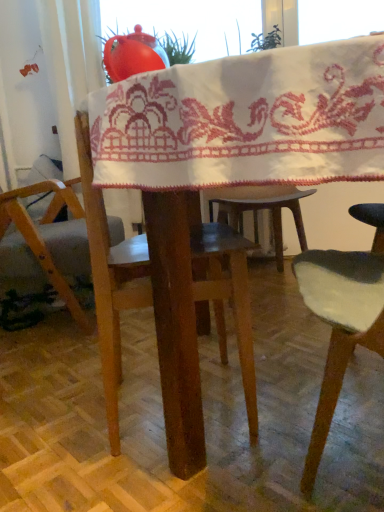
Locate an element on the screen. The width and height of the screenshot is (384, 512). wooden chair at left is located at coordinates (45, 244).

The height and width of the screenshot is (512, 384). In order to click on white embroidered cloth at center in this screenshot , I will do coord(245,120).

Which of these two, white embroidered cloth at center or wooden table at center, stands taller?

Standing taller between the two is wooden table at center.

How different are the orientations of white embroidered cloth at center and wooden table at center in degrees?

There is a 3.95e-05-degree angle between the facing directions of white embroidered cloth at center and wooden table at center.

This screenshot has width=384, height=512. Identify the location of table on the right side of white embroidered cloth at center. (221, 175).

Considering the positions of objects white embroidered cloth at center and wooden table at center in the image provided, who is in front, white embroidered cloth at center or wooden table at center?

Positioned in front is wooden table at center.

Could you tell me if wooden chair at left is facing wooden table at center?

No, wooden chair at left is not oriented towards wooden table at center.

Can you confirm if wooden chair at left is wider than wooden table at center?

No.

Can you confirm if wooden chair at left is positioned to the right of wooden table at center?

No.

In the scene shown: Are wooden table at center and white embroidered cloth at center far apart?

No, wooden table at center is not far away from white embroidered cloth at center.

Considering the relative sizes of wooden table at center and white embroidered cloth at center in the image provided, is wooden table at center bigger than white embroidered cloth at center?

Indeed, wooden table at center has a larger size compared to white embroidered cloth at center.

Would you say wooden table at center is inside or outside white embroidered cloth at center?

wooden table at center is not inside white embroidered cloth at center, it's outside.

Does wooden table at center come behind white embroidered cloth at center?

No.

Does wooden chair at left have a lesser height compared to white embroidered cloth at center?

No, wooden chair at left is not shorter than white embroidered cloth at center.

Considering the relative sizes of wooden chair at left and white embroidered cloth at center in the image provided, is wooden chair at left wider than white embroidered cloth at center?

No, wooden chair at left is not wider than white embroidered cloth at center.

From the image's perspective, is wooden chair at left located above or below white embroidered cloth at center?

From the image's perspective, wooden chair at left appears below white embroidered cloth at center.

Is wooden chair at left positioned far away from white embroidered cloth at center?

Yes.

Is white embroidered cloth at center oriented away from wooden chair at left?

No, white embroidered cloth at center is not facing the opposite direction of wooden chair at left.

The height and width of the screenshot is (512, 384). I want to click on blanket on the right of wooden chair at left, so click(245, 120).

Which is correct: white embroidered cloth at center is inside wooden chair at left, or outside of it?

white embroidered cloth at center lies outside wooden chair at left.

Is white embroidered cloth at center at the right side of wooden chair at left?

Correct, you'll find white embroidered cloth at center to the right of wooden chair at left.

Are wooden table at center and wooden chair at left located far from each other?

No.

Which point is more distant from viewer, (353, 102) or (19, 238)?

The point (19, 238) is behind.

In the scene shown: Is wooden table at center turned away from wooden chair at left?

No, wooden table at center is not facing the opposite direction of wooden chair at left.

Looking at the image, does wooden table at center seem bigger or smaller compared to wooden chair at left?

wooden table at center is bigger than wooden chair at left.

In order to click on blanket lying on the left of wooden table at center in this screenshot , I will do `click(245, 120)`.

I want to click on chair above the wooden table at center (from the image's perspective), so click(45, 244).

Looking at the image, which one is located further to wooden chair at left, white embroidered cloth at center or wooden table at center?

white embroidered cloth at center is positioned further to the anchor wooden chair at left.

Estimate the real-world distances between objects in this image. Which object is closer to white embroidered cloth at center, wooden chair at left or wooden table at center?

wooden table at center.

Considering their positions, is wooden table at center positioned further to wooden chair at left than white embroidered cloth at center?

Among the two, white embroidered cloth at center is located further to wooden chair at left.

When comparing their distances from white embroidered cloth at center, does wooden table at center or wooden chair at left seem closer?

wooden table at center is positioned closer to the anchor white embroidered cloth at center.

From the image, which object appears to be farther from wooden table at center, wooden chair at left or white embroidered cloth at center?

wooden chair at left lies further to wooden table at center than the other object.

From the image, which object appears to be nearer to wooden table at center, white embroidered cloth at center or wooden chair at left?

white embroidered cloth at center.

Find the location of a particular element. This screenshot has height=512, width=384. blanket between wooden table at center and wooden chair at left along the z-axis is located at coordinates (245, 120).